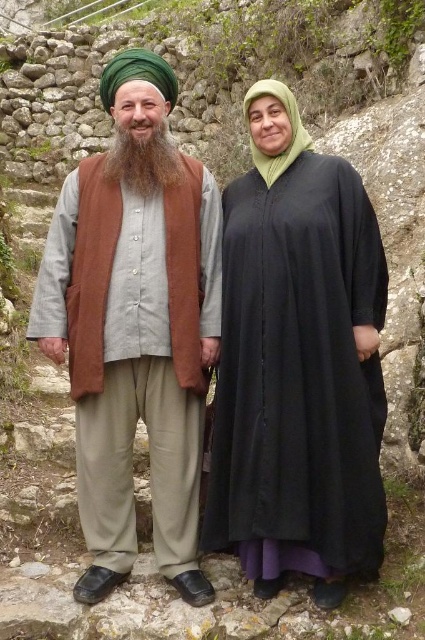
You are a photographer trying to capture the perfect shot of the brown fuzzy beard at center. According to the coordinates provided, where exactly should you position your camera to ensure the beard is centered in the frame?

The brown fuzzy beard at center is located at coordinates point (144,160), so to center it in the frame, the camera should be positioned to focus precisely on those coordinates.

You are a photographer trying to capture a photo of both the black matte dress at center and the brown fuzzy beard at center. Since you want to ensure both are in focus, you need to know their positions relative to each other. Which object is positioned to the right side?

The black matte dress at center is to the right of the brown fuzzy beard at center.

You are a photographer trying to capture a clear portrait of both the brown fuzzy beard at center and the green fabric headscarf at upper right. However, you notice that one of them is partially blocking the other. Which object is being blocked by the other?

The green fabric headscarf at upper right is behind brown fuzzy beard at center, so the brown fuzzy beard at center is blocking the green fabric headscarf at upper right.